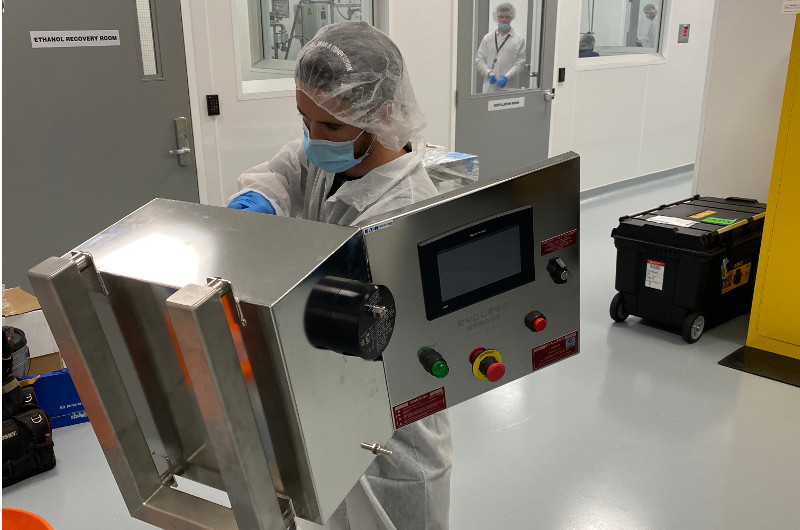
Where is `doors`? doors is located at coordinates (76, 147), (489, 130), (430, 326).